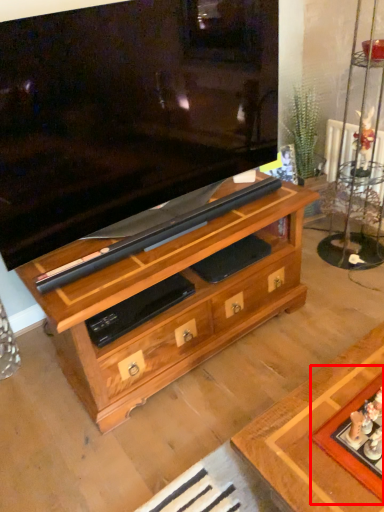
Question: From the image's perspective, where is board game (annotated by the red box) located in relation to chest of drawers in the image?

Choices:
 (A) below
 (B) above

Answer: (A)